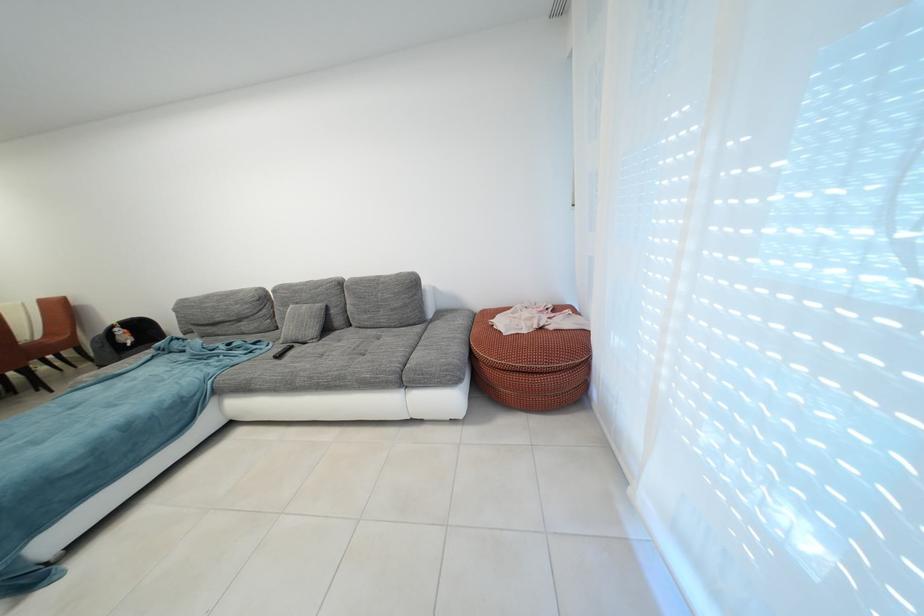
Where is `black remote control`? black remote control is located at coordinates (283, 351).